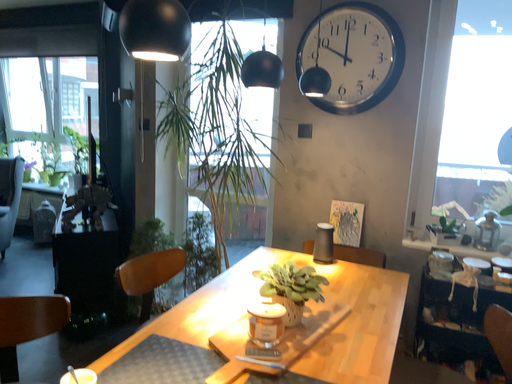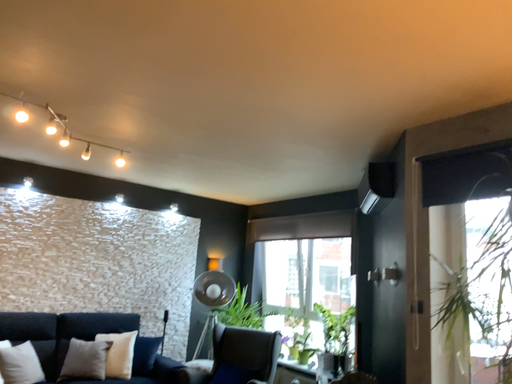
Question: How did the camera likely rotate when shooting the video?

Choices:
 (A) rotated downward
 (B) rotated upward

Answer: (B)